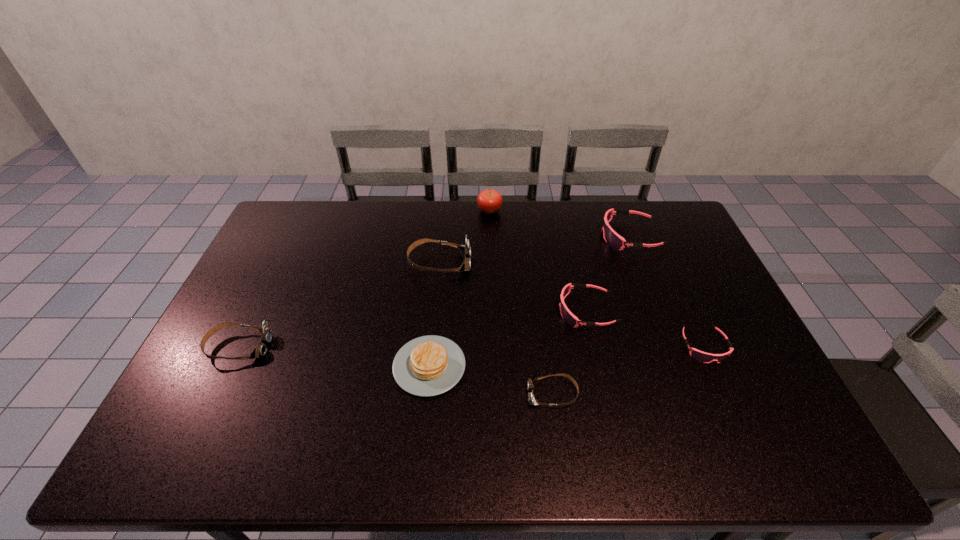
Locate an element on the screen. free space located 0.290m on the front-facing side of the second nearest brown goggles is located at coordinates (372, 347).

Locate an element on the screen. This screenshot has height=540, width=960. vacant space located 0.260m on the left of the pancake is located at coordinates click(297, 366).

Where is `free space located 0.190m on the front-facing side of the smallest pink goggles`? Image resolution: width=960 pixels, height=540 pixels. free space located 0.190m on the front-facing side of the smallest pink goggles is located at coordinates (743, 432).

At what (x,y) coordinates should I click in order to perform the action: click on vacant space situated 0.080m on the front-facing side of the nearest goggles. Please return your answer as a coordinate pair (x, y). The width and height of the screenshot is (960, 540). Looking at the image, I should click on (496, 394).

The width and height of the screenshot is (960, 540). What are the coordinates of `vacant point located 0.200m on the front-facing side of the nearest goggles` in the screenshot? It's located at (449, 394).

Where is `vacant space located 0.380m on the front-facing side of the nearest goggles`? vacant space located 0.380m on the front-facing side of the nearest goggles is located at coordinates (378, 394).

You are a GUI agent. You are given a task and a screenshot of the screen. Output one action in this format:
    pyautogui.click(x=<x>, y=<y>)
    Task: Click on the apple situated at the far edge
    
    Given the screenshot: What is the action you would take?
    pyautogui.click(x=489, y=201)

This screenshot has width=960, height=540. Find the location of `goggles at the far edge`. goggles at the far edge is located at coordinates (613, 239).

Locate an element on the screen. object that is positioned at the left edge is located at coordinates (266, 333).

Locate an element on the screen. The height and width of the screenshot is (540, 960). object located at the far right corner is located at coordinates point(613,239).